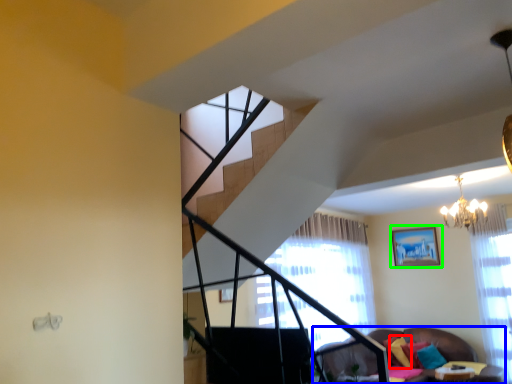
Question: Considering the real-world distances, which object is farthest from pillow (highlighted by a red box)? studio couch (highlighted by a blue box) or picture frame (highlighted by a green box)?

Choices:
 (A) studio couch
 (B) picture frame

Answer: (A)